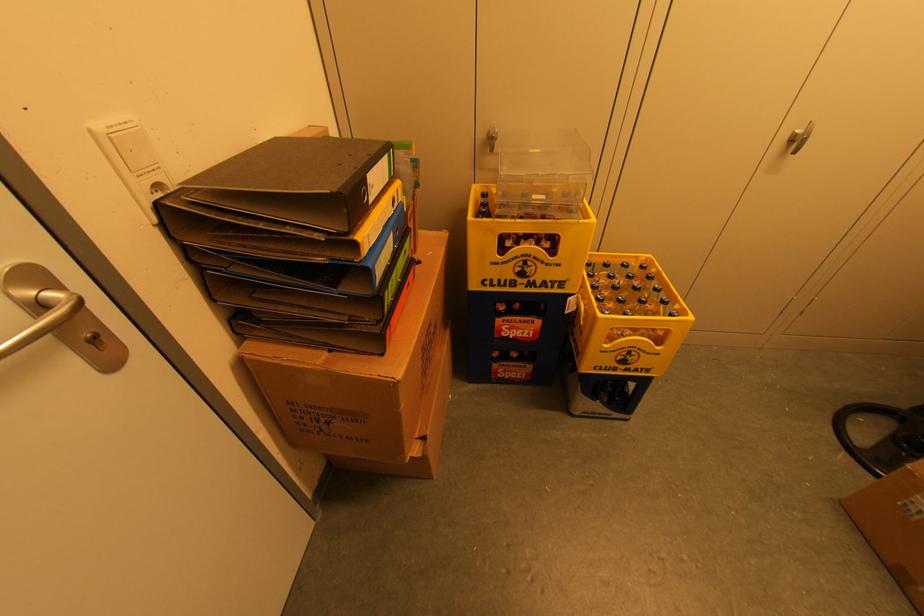
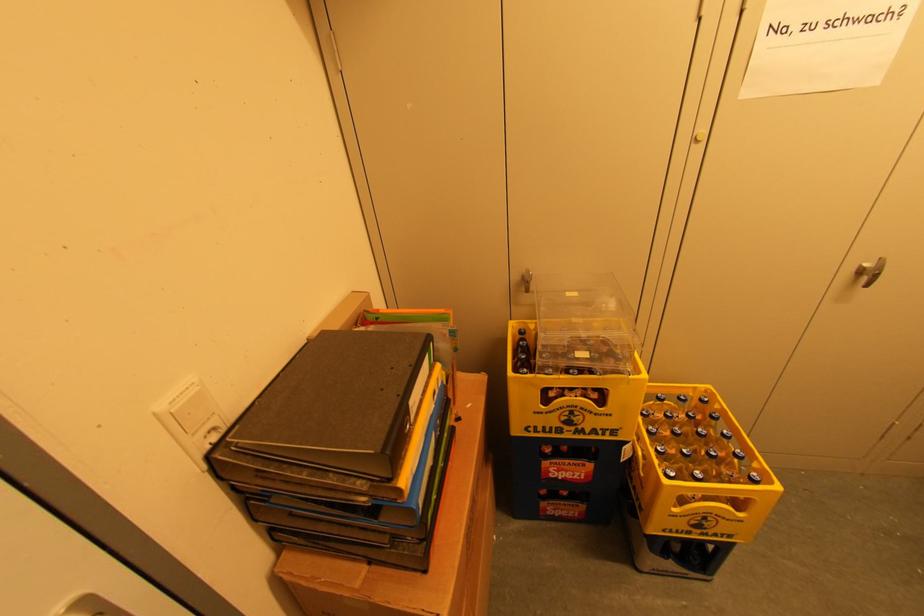
The point at (530, 270) is marked in the first image. Where is the corresponding point in the second image?

(578, 419)